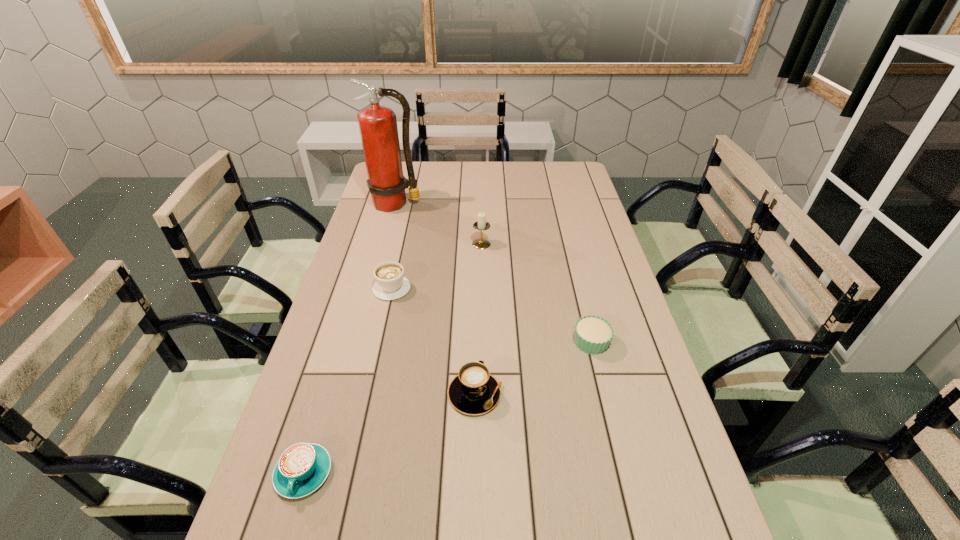
I want to click on the nearest object, so coord(302,468).

Find the location of a particular element. The image size is (960, 540). free space located at the nozzle of the farthest object is located at coordinates (389, 230).

Identify the location of vacant space located 0.260m on the back of the second tallest object. (481, 201).

Image resolution: width=960 pixels, height=540 pixels. I want to click on vacant position located on the right of the fifth farthest object, so click(562, 394).

Locate an element on the screen. The width and height of the screenshot is (960, 540). free space located to the right of the fourth nearest object's handle is located at coordinates (408, 217).

The image size is (960, 540). What are the coordinates of `vacant space located 0.250m to the right of the fourth nearest object's handle` in the screenshot? It's located at (404, 232).

Identify the location of free space located 0.240m to the right of the fourth nearest object's handle. (404, 233).

You are a GUI agent. You are given a task and a screenshot of the screen. Output one action in this format:
    pyautogui.click(x=<x>, y=<y>)
    Task: Click on the vacant space located on the left of the rightmost object
    
    Given the screenshot: What is the action you would take?
    pyautogui.click(x=544, y=342)

The image size is (960, 540). I want to click on vacant space located 0.070m with the handle on the right side of the nearest object, so click(284, 538).

I want to click on fire extinguisher present at the left edge, so click(378, 127).